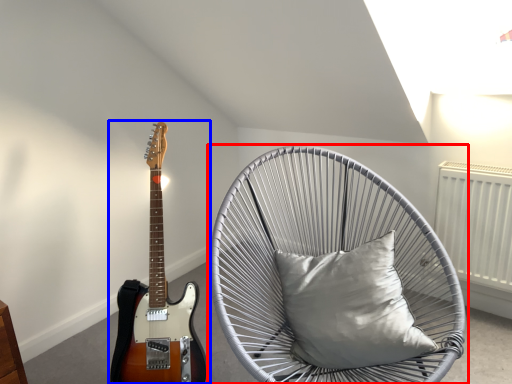
Question: Which object is further to the camera taking this photo, chair (highlighted by a red box) or guitar (highlighted by a blue box)?

Choices:
 (A) chair
 (B) guitar

Answer: (B)